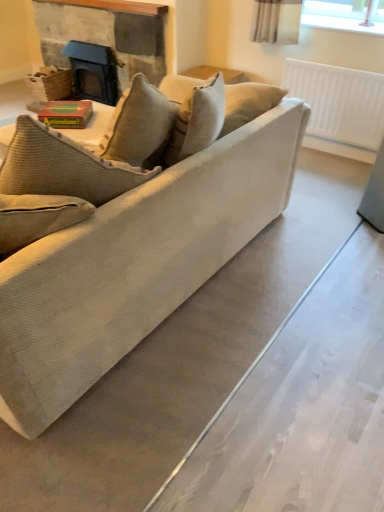
The height and width of the screenshot is (512, 384). Find the location of `white plastic radiator at upper right`. white plastic radiator at upper right is located at coordinates (339, 101).

The height and width of the screenshot is (512, 384). Describe the element at coordinates (135, 265) in the screenshot. I see `beige corduroy couch at center` at that location.

At what (x,y) coordinates should I click in order to perform the action: click on yellow-green cardboard book at center. Please return your answer as a coordinate pair (x, y). Image resolution: width=384 pixels, height=512 pixels. Looking at the image, I should click on (66, 114).

Consider the image. What is the approximate width of yellow-green cardboard book at center?

yellow-green cardboard book at center is 11.20 inches wide.

This screenshot has height=512, width=384. I want to click on matte black fireplace at upper left, so point(105,33).

Are yellow-green cardboard book at center and beige corduroy couch at center making contact?

No.

From the picture: What's the angular difference between yellow-green cardboard book at center and beige corduroy couch at center's facing directions?

yellow-green cardboard book at center and beige corduroy couch at center are facing 36.2 degrees away from each other.

Identify the location of studio couch lying in front of the yellow-green cardboard book at center. (135, 265).

Can you confirm if yellow-green cardboard book at center is shorter than beige corduroy couch at center?

Correct, yellow-green cardboard book at center is not as tall as beige corduroy couch at center.

Based on the photo, based on their positions, is beige corduroy couch at center located to the left or right of yellow-green cardboard book at center?

From the image, it's evident that beige corduroy couch at center is to the right of yellow-green cardboard book at center.

Would you consider beige corduroy couch at center to be distant from yellow-green cardboard book at center?

Yes.

Where is `studio couch that appears above the yellow-green cardboard book at center (from a real-world perspective)`? The width and height of the screenshot is (384, 512). studio couch that appears above the yellow-green cardboard book at center (from a real-world perspective) is located at coordinates (135, 265).

Is yellow-green cardboard book at center a part of beige corduroy couch at center?

Yes, yellow-green cardboard book at center is a part of beige corduroy couch at center.

From a real-world perspective, relative to white plastic radiator at upper right, is matte black fireplace at upper left vertically above or below?

From a real-world perspective, matte black fireplace at upper left is physically above white plastic radiator at upper right.

Would you say white plastic radiator at upper right is part of matte black fireplace at upper left's contents?

That's incorrect, white plastic radiator at upper right is not inside matte black fireplace at upper left.

In the scene shown: Does matte black fireplace at upper left lie behind white plastic radiator at upper right?

Yes, it is.

This screenshot has width=384, height=512. What are the coordinates of `radiator that is in front of the matte black fireplace at upper left` in the screenshot? It's located at (339, 101).

Who is smaller, white plastic radiator at upper right or beige corduroy couch at center?

white plastic radiator at upper right.

Is white plastic radiator at upper right situated inside beige corduroy couch at center or outside?

white plastic radiator at upper right is spatially situated outside beige corduroy couch at center.

Is white plastic radiator at upper right positioned before beige corduroy couch at center?

That is False.

Is matte black fireplace at upper left bigger than beige corduroy couch at center?

Actually, matte black fireplace at upper left might be smaller than beige corduroy couch at center.

Considering the positions of point (162, 9) and point (67, 336), is point (162, 9) closer or farther from the camera than point (67, 336)?

Clearly, point (162, 9) is more distant from the camera than point (67, 336).

Is beige corduroy couch at center at the back of matte black fireplace at upper left?

No, matte black fireplace at upper left's orientation is not away from beige corduroy couch at center.

Who is shorter, matte black fireplace at upper left or beige corduroy couch at center?

Standing shorter between the two is matte black fireplace at upper left.

Can you confirm if yellow-green cardboard book at center is smaller than white plastic radiator at upper right?

Correct, yellow-green cardboard book at center occupies less space than white plastic radiator at upper right.

In terms of height, does yellow-green cardboard book at center look taller or shorter compared to white plastic radiator at upper right?

Considering their sizes, yellow-green cardboard book at center has less height than white plastic radiator at upper right.

Is point (81, 122) positioned behind point (327, 126)?

No.

Is yellow-green cardboard book at center positioned with its back to white plastic radiator at upper right?

Absolutely, yellow-green cardboard book at center is directed away from white plastic radiator at upper right.

The image size is (384, 512). What are the coordinates of `fireplace below the yellow-green cardboard book at center (from a real-world perspective)` in the screenshot? It's located at (105, 33).

From the image's perspective, is matte black fireplace at upper left under yellow-green cardboard book at center?

No, from the image's perspective, matte black fireplace at upper left is not beneath yellow-green cardboard book at center.

Would you say matte black fireplace at upper left is outside yellow-green cardboard book at center?

Absolutely, matte black fireplace at upper left is external to yellow-green cardboard book at center.

Can you confirm if matte black fireplace at upper left is shorter than yellow-green cardboard book at center?

Incorrect, the height of matte black fireplace at upper left does not fall short of that of yellow-green cardboard book at center.

I want to click on book that is on the left side of beige corduroy couch at center, so click(66, 114).

The height and width of the screenshot is (512, 384). I want to click on studio couch on the right of yellow-green cardboard book at center, so (135, 265).

Estimate the real-world distances between objects in this image. Which object is further from white plastic radiator at upper right, beige corduroy couch at center or matte black fireplace at upper left?

beige corduroy couch at center.

Considering their positions, is matte black fireplace at upper left positioned closer to yellow-green cardboard book at center than white plastic radiator at upper right?

The object closer to yellow-green cardboard book at center is matte black fireplace at upper left.

Considering their positions, is matte black fireplace at upper left positioned further to yellow-green cardboard book at center than beige corduroy couch at center?

matte black fireplace at upper left is further to yellow-green cardboard book at center.

When comparing their distances from matte black fireplace at upper left, does beige corduroy couch at center or yellow-green cardboard book at center seem closer?

The object closer to matte black fireplace at upper left is yellow-green cardboard book at center.

Considering their positions, is beige corduroy couch at center positioned closer to yellow-green cardboard book at center than matte black fireplace at upper left?

Based on the image, beige corduroy couch at center appears to be nearer to yellow-green cardboard book at center.

When comparing their distances from white plastic radiator at upper right, does matte black fireplace at upper left or beige corduroy couch at center seem further?

beige corduroy couch at center is further to white plastic radiator at upper right.

Which object lies further to the anchor point beige corduroy couch at center, matte black fireplace at upper left or yellow-green cardboard book at center?

matte black fireplace at upper left.

Based on their spatial positions, is white plastic radiator at upper right or yellow-green cardboard book at center closer to beige corduroy couch at center?

Among the two, yellow-green cardboard book at center is located nearer to beige corduroy couch at center.

I want to click on radiator positioned between beige corduroy couch at center and matte black fireplace at upper left from near to far, so click(339, 101).

This screenshot has height=512, width=384. I want to click on book between beige corduroy couch at center and white plastic radiator at upper right along the z-axis, so click(66, 114).

This screenshot has width=384, height=512. I want to click on book between beige corduroy couch at center and matte black fireplace at upper left from front to back, so point(66,114).

Locate an element on the screen. book situated between matte black fireplace at upper left and white plastic radiator at upper right from left to right is located at coordinates (66, 114).